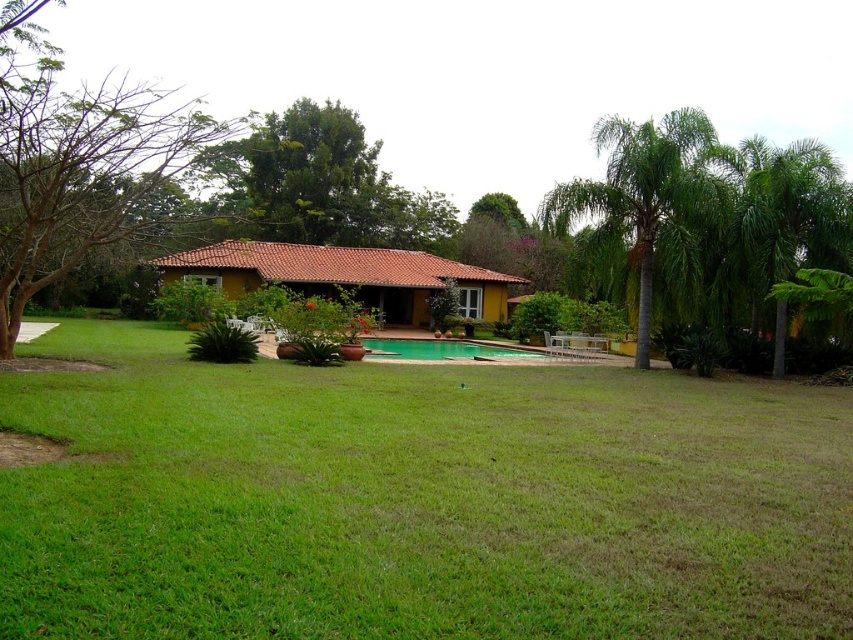
Does bare branches at left have a smaller size compared to green glossy pool at center?

No.

Between bare branches at left and green glossy pool at center, which one appears on the right side from the viewer's perspective?

From the viewer's perspective, green glossy pool at center appears more on the right side.

Where is `bare branches at left`? bare branches at left is located at coordinates (79, 168).

Which is above, green grass at center or green glossy pool at center?

green glossy pool at center

Between green grass at center and green glossy pool at center, which one appears on the right side from the viewer's perspective?

From the viewer's perspective, green glossy pool at center appears more on the right side.

Find the location of a particular element. The width and height of the screenshot is (853, 640). green grass at center is located at coordinates tap(418, 500).

I want to click on green grass at center, so click(x=418, y=500).

Is green leafy palm tree at right positioned behind green glossy pool at center?

No, it is not.

Does green leafy palm tree at right lie in front of green glossy pool at center?

Yes.

The height and width of the screenshot is (640, 853). What do you see at coordinates (648, 204) in the screenshot? I see `green leafy palm tree at right` at bounding box center [648, 204].

Where is `green leafy palm tree at right`? The image size is (853, 640). green leafy palm tree at right is located at coordinates pos(648,204).